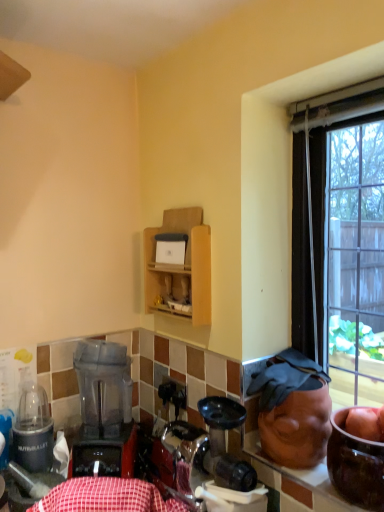
Question: From the image's perspective, is wooden cabinet at upper center above or below translucent plastic blender at lower left?

Choices:
 (A) below
 (B) above

Answer: (B)

Question: From a real-world perspective, is wooden cabinet at upper center above or below translucent plastic blender at lower left?

Choices:
 (A) above
 (B) below

Answer: (A)

Question: Which of these objects is positioned farthest from the wooden cabinet at upper center?

Choices:
 (A) red checkered tablecloth at lower center
 (B) translucent plastic blender at lower left
 (C) metallic silver blender at left

Answer: (C)

Question: Estimate the real-world distances between objects in this image. Which object is closer to the translucent plastic blender at lower left?

Choices:
 (A) wooden cabinet at upper center
 (B) red checkered tablecloth at lower center
 (C) metallic silver blender at left

Answer: (C)